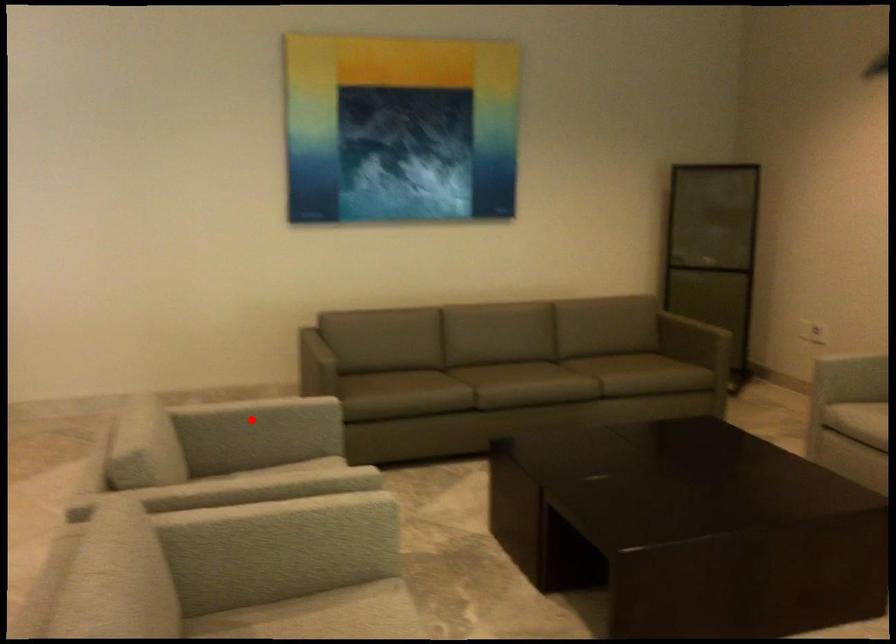
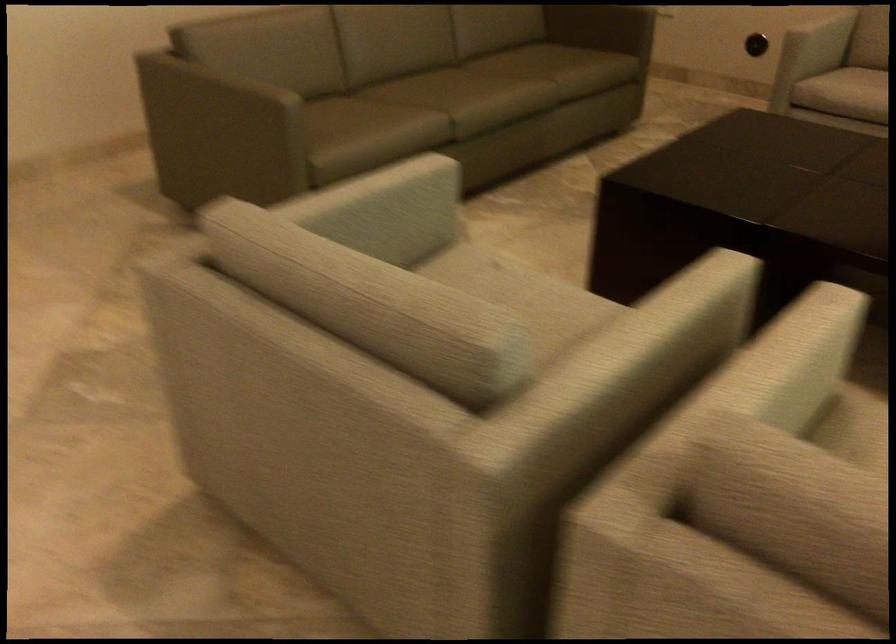
In the second image, find the point that corresponds to the highlighted location in the first image.

(380, 210)